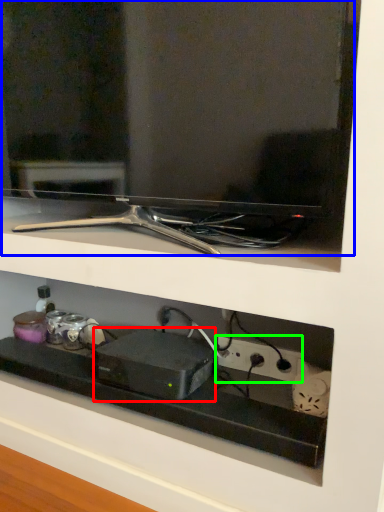
Question: Estimate the real-world distances between objects in this image. Which object is closer to appliance (highlighted by a red box), tv show (highlighted by a blue box) or electric outlet (highlighted by a green box)?

Choices:
 (A) tv show
 (B) electric outlet

Answer: (B)